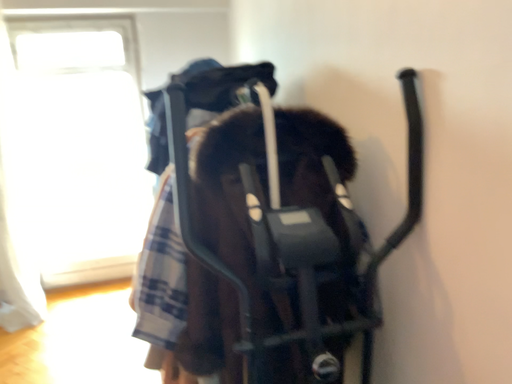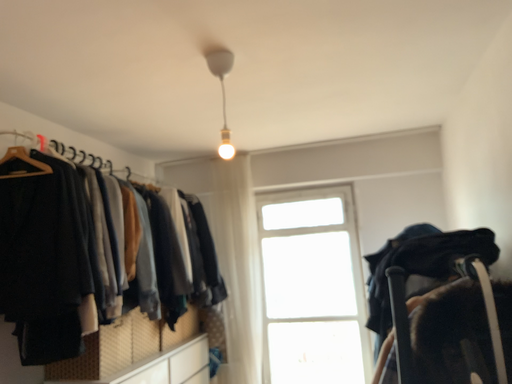
Question: Which way did the camera rotate in the video?

Choices:
 (A) rotated downward
 (B) rotated upward

Answer: (B)